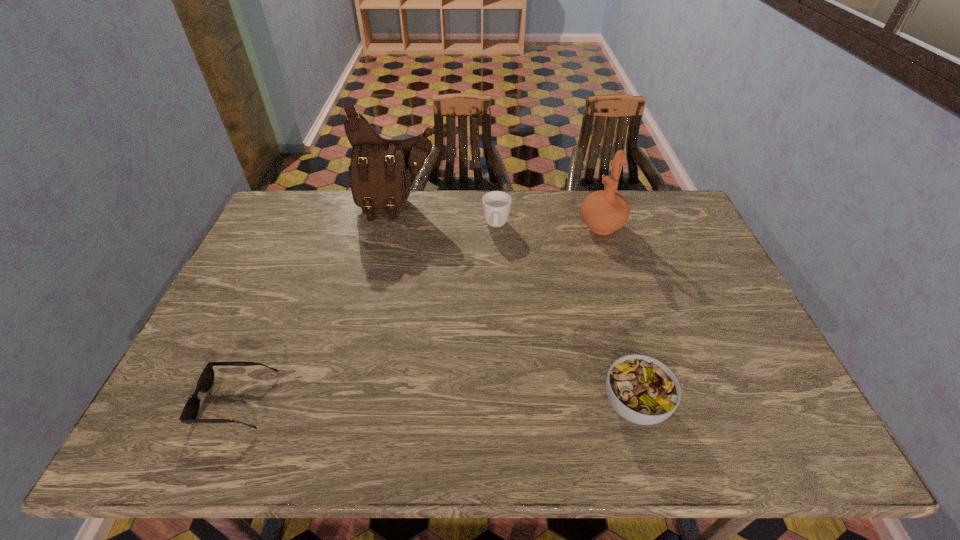
This screenshot has width=960, height=540. In order to click on the leftmost object in this screenshot , I will do `click(191, 409)`.

You are a GUI agent. You are given a task and a screenshot of the screen. Output one action in this format:
    pyautogui.click(x=<x>, y=<y>)
    Task: Click on the sunglasses
    The height and width of the screenshot is (540, 960).
    Given the screenshot: What is the action you would take?
    pyautogui.click(x=191, y=409)

Where is `soup bowl`? The height and width of the screenshot is (540, 960). soup bowl is located at coordinates (643, 390).

At what (x,y) coordinates should I click in order to perform the action: click on the third object from left to right. Please return your answer as a coordinate pair (x, y). The width and height of the screenshot is (960, 540). Looking at the image, I should click on (496, 205).

Where is `the second tallest object`? Image resolution: width=960 pixels, height=540 pixels. the second tallest object is located at coordinates (605, 211).

This screenshot has width=960, height=540. I want to click on shoulder bag, so click(x=382, y=171).

Locate an element on the screen. The image size is (960, 540). the tallest object is located at coordinates (382, 171).

This screenshot has height=540, width=960. Identify the location of vacant space located 0.070m at the front lenses of the sunglasses. (173, 401).

Identify the location of free space located on the left of the soup bowl. This screenshot has height=540, width=960. (537, 404).

Locate an element on the screen. The width and height of the screenshot is (960, 540). blank space located with the handle on the side of the cup is located at coordinates (492, 337).